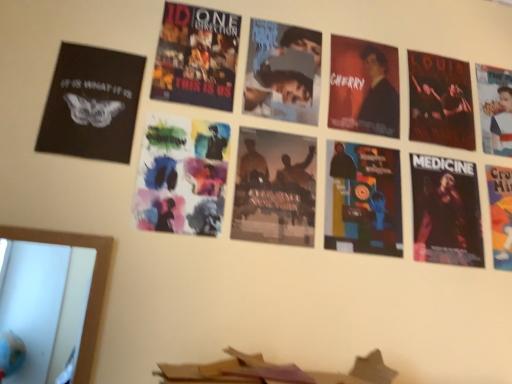
Question: Which is correct: matte black poster at center, the 4th poster when ordered from right to left, is inside matte black suit at upper right, or outside of it?

Choices:
 (A) inside
 (B) outside

Answer: (B)

Question: In terms of width, does matte black poster at center, acting as the 4th poster starting from the left, look wider or thinner when compared to matte black suit at upper right?

Choices:
 (A) wide
 (B) thin

Answer: (B)

Question: Which object is the closest to the orange paper poster at right, marked as the second poster in a right-to-left arrangement?

Choices:
 (A) black matte poster at upper left, arranged as the 7th poster when viewed from the right
 (B) black glossy poster at right, acting as the 3th poster starting from the right
 (C) watercolor paper at center, which is the 2th poster in left-to-right order
 (D) matte black suit at upper right
 (E) white paper poster at upper right, which is counted as the seventh poster, starting from the left

Answer: (B)

Question: Based on their relative distances, which object is nearer to the black glossy poster at right, acting as the 3th poster starting from the right?

Choices:
 (A) black matte poster at upper left, arranged as the 7th poster when viewed from the right
 (B) silvery metallic poster at center, the 3th poster when ordered from left to right
 (C) matte black suit at upper right
 (D) orange paper poster at right, marked as the second poster in a right-to-left arrangement
 (E) watercolor paper at center, the sixth poster in the right-to-left sequence

Answer: (D)